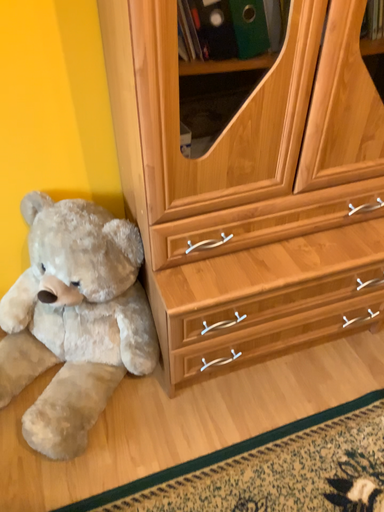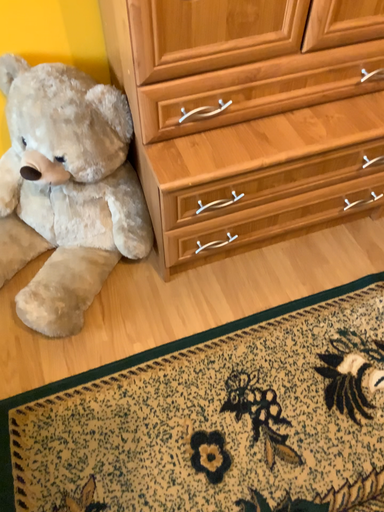
Question: How did the camera likely rotate when shooting the video?

Choices:
 (A) rotated upward
 (B) rotated downward

Answer: (B)